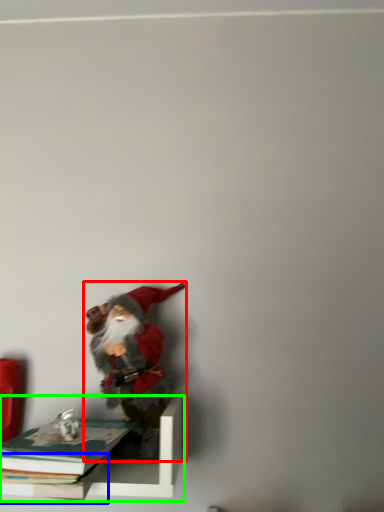
Question: Based on their relative distances, which object is farther from person (highlighted by a red box)? Choose from book (highlighted by a blue box) and shelf (highlighted by a green box).

Choices:
 (A) book
 (B) shelf

Answer: (A)